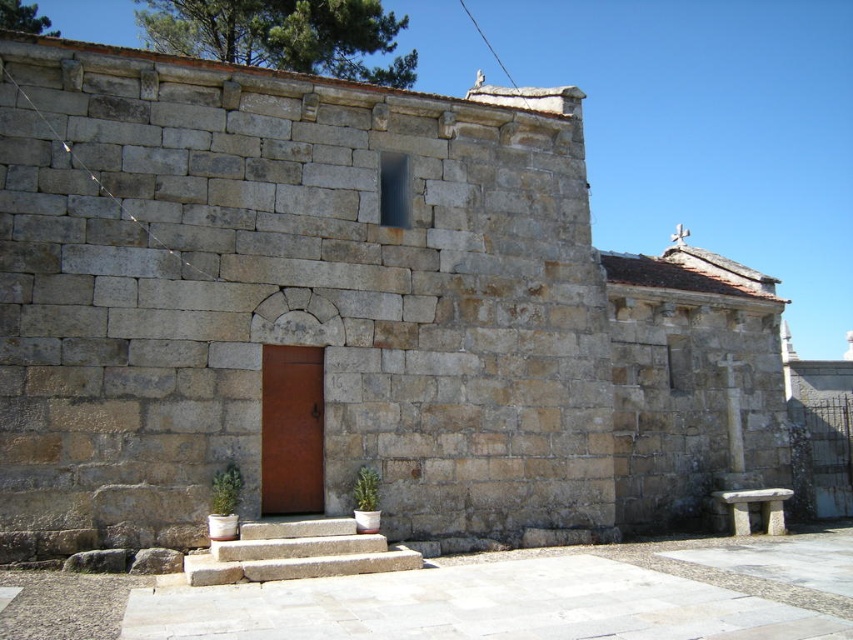
Question: Which point appears closest to the camera in this image?

Choices:
 (A) (374, 486)
 (B) (335, 531)
 (C) (281, 464)
 (D) (231, 468)

Answer: (B)

Question: Can you confirm if rusty metal door at center is smaller than green leafy plant at center?

Choices:
 (A) yes
 (B) no

Answer: (B)

Question: Among these points, which one is farthest from the camera?

Choices:
 (A) (407, 557)
 (B) (288, 392)

Answer: (B)

Question: Which point appears farthest from the camera in this image?

Choices:
 (A) (228, 472)
 (B) (364, 476)
 (C) (270, 572)

Answer: (B)

Question: Where is rusty metal door at center located in relation to green leafy plant at center in the image?

Choices:
 (A) left
 (B) right

Answer: (A)

Question: Does natural stone stairs at center have a smaller size compared to rusty metal door at center?

Choices:
 (A) yes
 (B) no

Answer: (B)